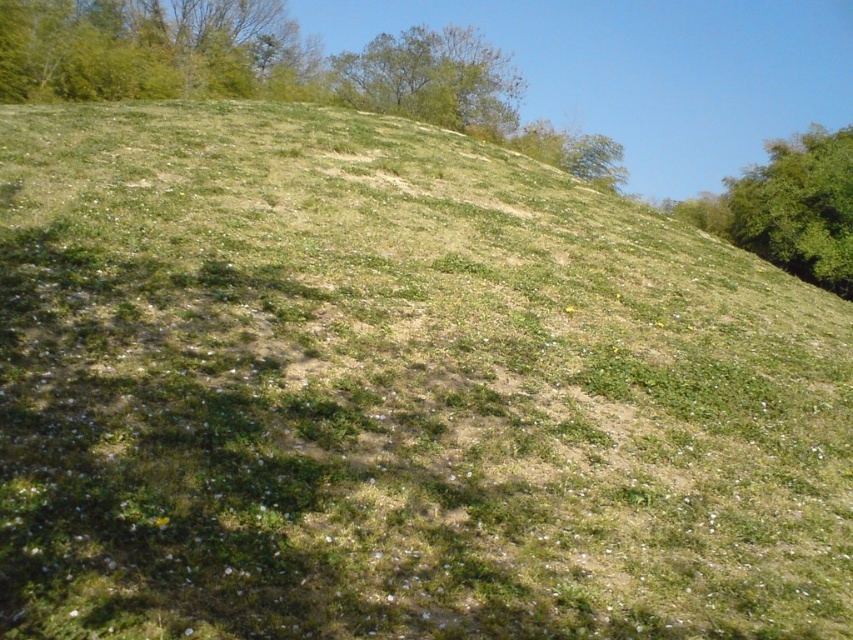
Consider the image. You are planning to plant a new tree in the area between the green leafy tree at upper right and the green leafy tree at upper center. Based on their sizes, which tree would provide more shade for your new tree?

The green leafy tree at upper right is bigger than the green leafy tree at upper center, so it would provide more shade for the new tree.

You are standing at the bottom of the hill and want to walk towards the green leafy tree at upper left and the green leafy tree at upper right. Which tree will you reach first?

The green leafy tree at upper left is closer to the viewer than the green leafy tree at upper right, so you will reach the green leafy tree at upper left first.